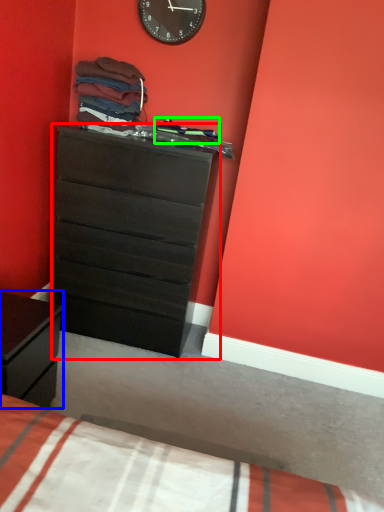
Question: Estimate the real-world distances between objects in this image. Which object is closer to chest of drawers (highlighted by a red box), nightstand (highlighted by a blue box) or clothing (highlighted by a green box)?

Choices:
 (A) nightstand
 (B) clothing

Answer: (B)